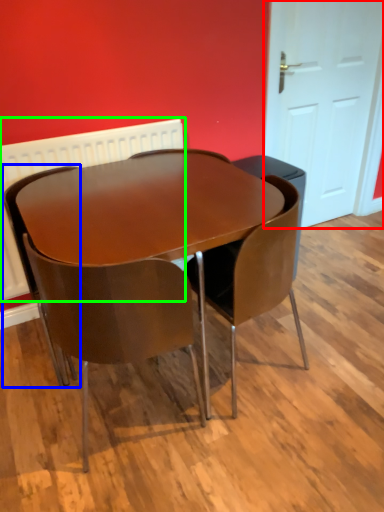
Question: Estimate the real-world distances between objects in this image. Which object is farther from door (highlighted by a red box), chair (highlighted by a blue box) or radiator (highlighted by a green box)?

Choices:
 (A) chair
 (B) radiator

Answer: (A)